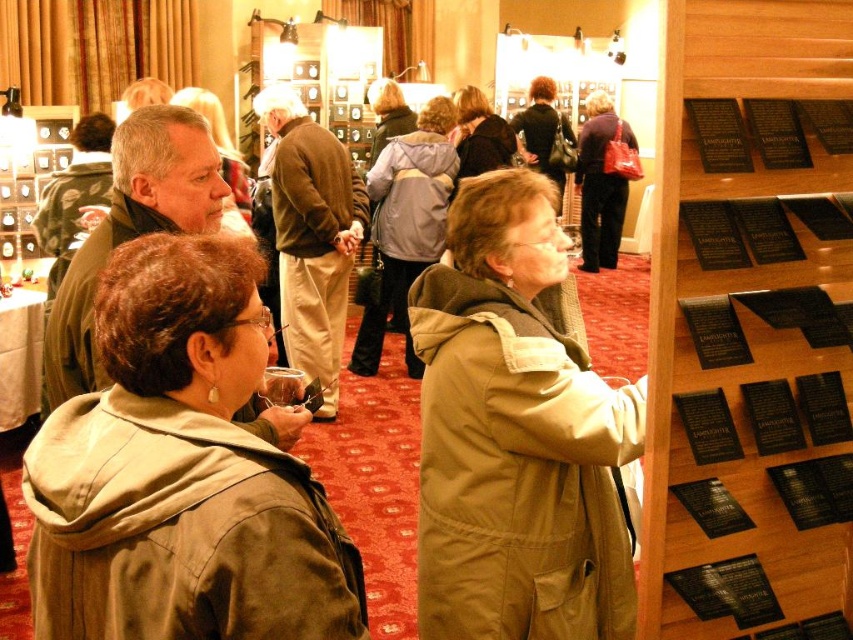
Does tan fabric trench coat at center have a greater height compared to brown leather jacket at center?

No, tan fabric trench coat at center is not taller than brown leather jacket at center.

Which is behind, point (532, 461) or point (297, 268)?

The point (297, 268) is more distant.

You are a GUI agent. You are given a task and a screenshot of the screen. Output one action in this format:
    pyautogui.click(x=<x>, y=<y>)
    Task: Click on the tan fabric trench coat at center
    The image size is (853, 640).
    Given the screenshot: What is the action you would take?
    pyautogui.click(x=515, y=436)

Is point (558, 570) positioned behind point (86, 371)?

Yes, point (558, 570) is farther from viewer.

Describe the element at coordinates (515, 436) in the screenshot. I see `tan fabric trench coat at center` at that location.

Identify the location of tan fabric trench coat at center. (515, 436).

Who is positioned more to the right, brown leather jacket at center or matte brown jacket at center?

Positioned to the right is matte brown jacket at center.

Which is in front, point (283, 316) or point (194, 134)?

Point (194, 134) is in front.

Find the location of a particular element. The height and width of the screenshot is (640, 853). brown leather jacket at center is located at coordinates click(312, 236).